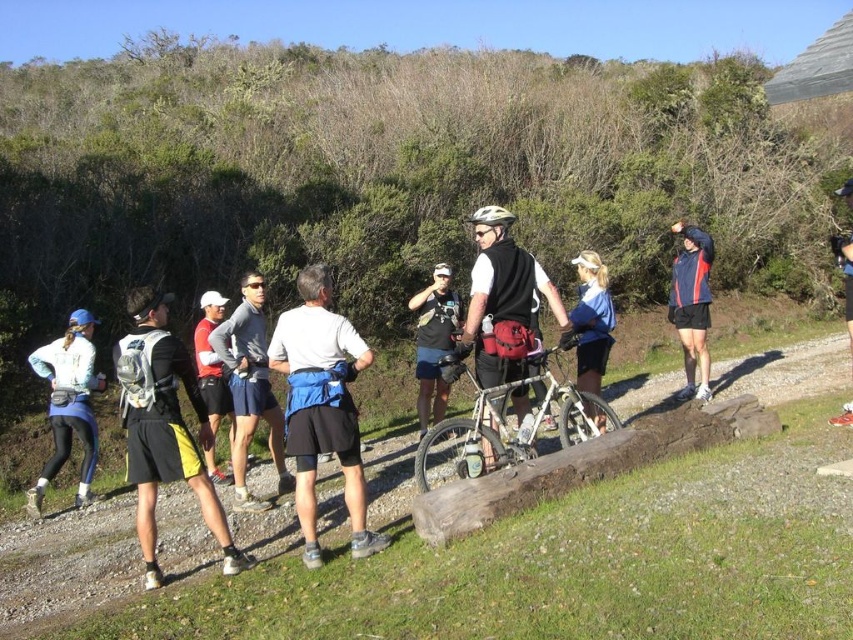
You are a photographer trying to capture a clear shot of the blue fabric shorts at center and the blue fabric shirt at center. Since both are blue, you want to ensure that the shorts stand out in the photo. Based on their positions, which clothing item will naturally appear larger in the photo?

The blue fabric shorts at center will naturally appear larger in the photo because it is taller than the blue fabric shirt at center.

You are a photographer standing at the origin point of the image coordinate system. You want to capture a photo of the blue fabric shorts at center. What are the coordinates where you should aim your camera?

The coordinates to aim your camera are at point (x=322, y=406) to capture the blue fabric shorts at center.